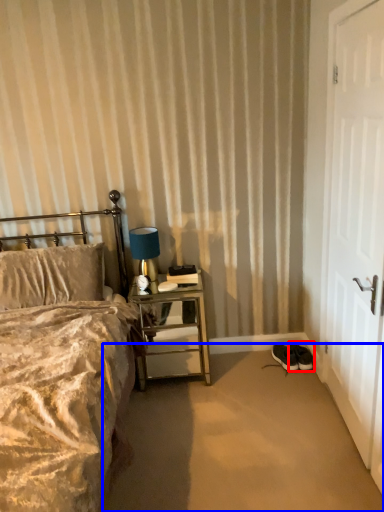
Question: Which of the following is the farthest to the observer, footwear (highlighted by a red box) or plain (highlighted by a blue box)?

Choices:
 (A) footwear
 (B) plain

Answer: (A)